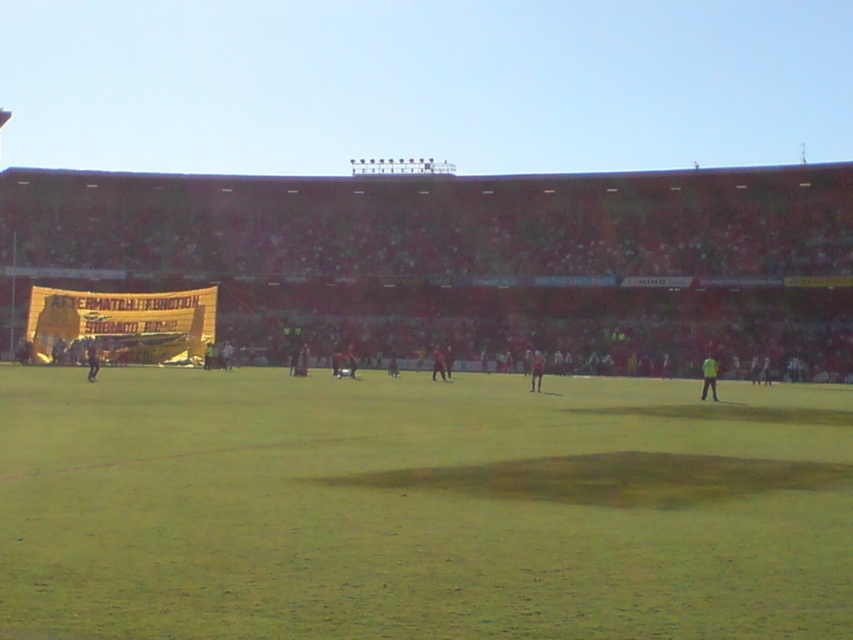
You are a photographer positioned at the back of the stadium. You want to capture a photo that includes both the dark red jersey at center and the dark green jersey at left. Based on their positions, which jersey will appear larger in the photo?

The dark red jersey at center is taller than the dark green jersey at left, so it will appear larger in the photo.

You are a drone operator trying to capture aerial shots of the soccer stadium. You have two points marked on your screen for camera positioning. Point A is at coordinates point (434,352) and Point B is at point (96,362). Which point should you choose to get a closer shot of the players on the field?

Point A at coordinates point (434,352) is closer to the players on the field because it is further to the viewer than point (96,362), meaning it is positioned nearer to the camera.